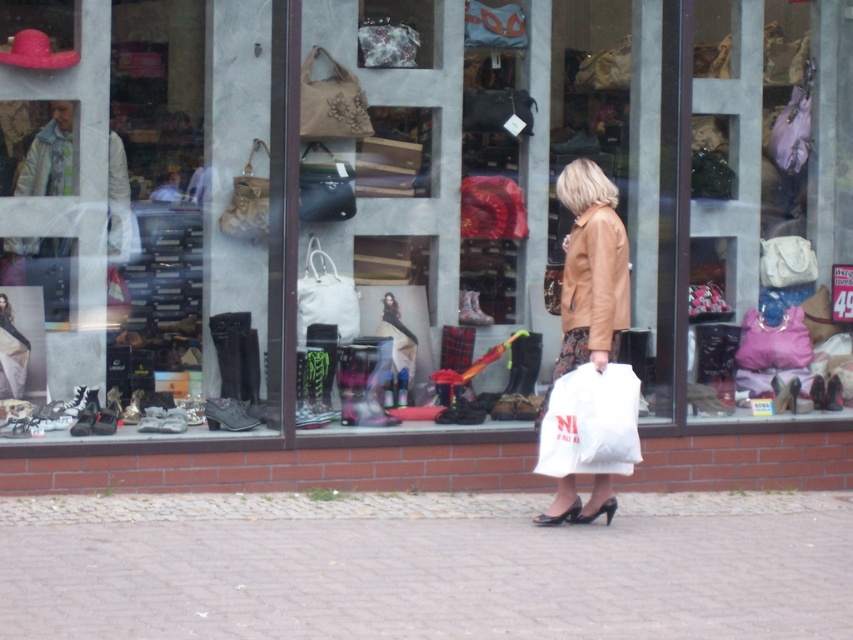
Question: Does matte brown leather jacket at center appear over matte black shoe at left?

Choices:
 (A) yes
 (B) no

Answer: (A)

Question: Among these points, which one is nearest to the camera?

Choices:
 (A) (607, 198)
 (B) (251, 536)
 (C) (607, 314)

Answer: (B)

Question: Does gray cobblestone pavement at lower center lie in front of leather jacket at center?

Choices:
 (A) yes
 (B) no

Answer: (A)

Question: Which point appears closest to the camera in this image?

Choices:
 (A) (573, 320)
 (B) (4, 371)
 (C) (610, 323)
 (D) (523, 593)

Answer: (D)

Question: Which point is farther to the camera?

Choices:
 (A) (572, 310)
 (B) (653, 513)
 (C) (614, 275)
 (D) (15, 356)

Answer: (D)

Question: Can you confirm if gray cobblestone pavement at lower center is thinner than matte black shoe at left?

Choices:
 (A) yes
 (B) no

Answer: (B)